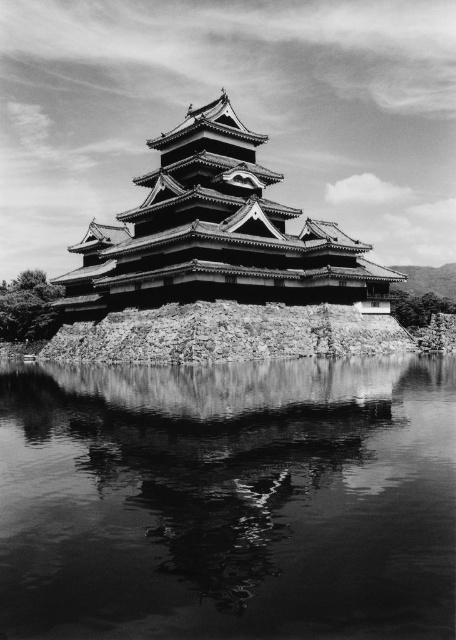
You are a tour guide leading a group to Matsumoto Castle. You want to inform your group about the distance between the smooth reflective water at center and the wooden pagoda at center. What do you tell them?

The smooth reflective water at center is 28.30 meters away from the wooden pagoda at center.

From the picture: You are a tourist visiting Matsumoto Castle. You see the smooth reflective water at center and the wooden pagoda at center. Which object is located lower in the image?

The smooth reflective water at center is located below the wooden pagoda at center, so it is lower in the image.

You are standing in front of Matsumoto Castle and want to take a photo that includes both the smooth reflective water at center and the wooden pagoda at center. Which object should you focus on first to ensure both are in the frame?

You should focus on the smooth reflective water at center first because it is closer to you than the wooden pagoda at center, so adjusting the camera to include it will also capture the pagoda in the background.